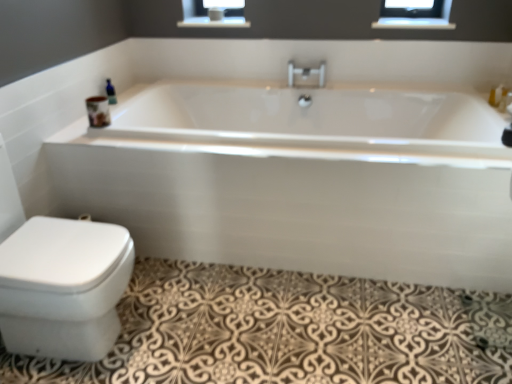
This screenshot has height=384, width=512. I want to click on unoccupied region to the right of blue glass bottle at upper left, so click(131, 105).